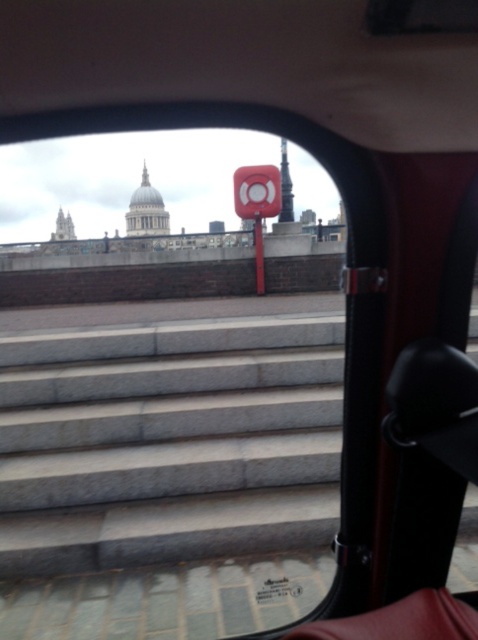
In the scene shown: You are a passenger in a vehicle and looking out the window. You see a point marked at coordinate (169, 442). What is this point located on?

The point marked at coordinate (169, 442) is located on the gray concrete stairs at center.

You are a passenger in a vehicle and notice the gray concrete stairs at center and the black plastic rearview mirror at upper right. Which object is higher in the image?

The gray concrete stairs at center is taller than the black plastic rearview mirror at upper right.